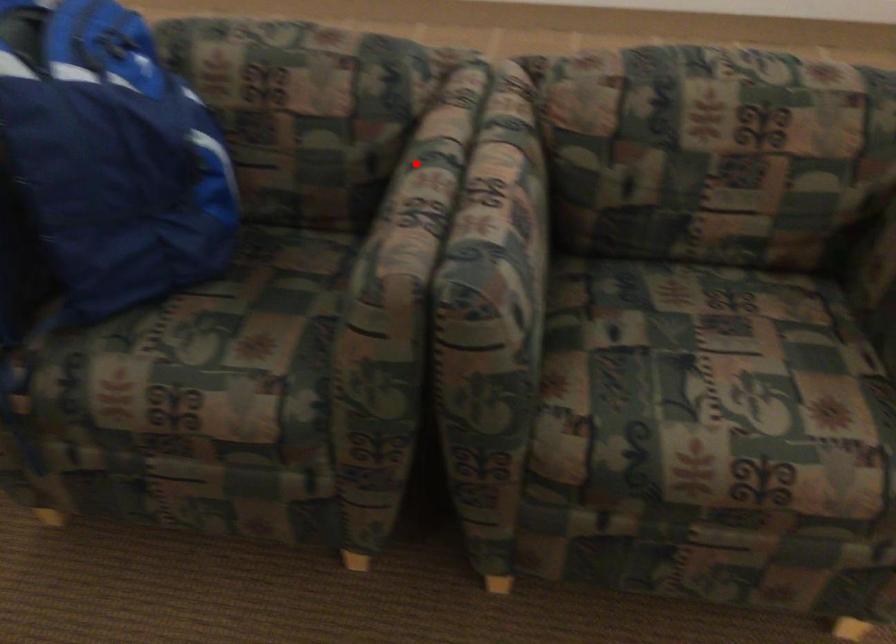
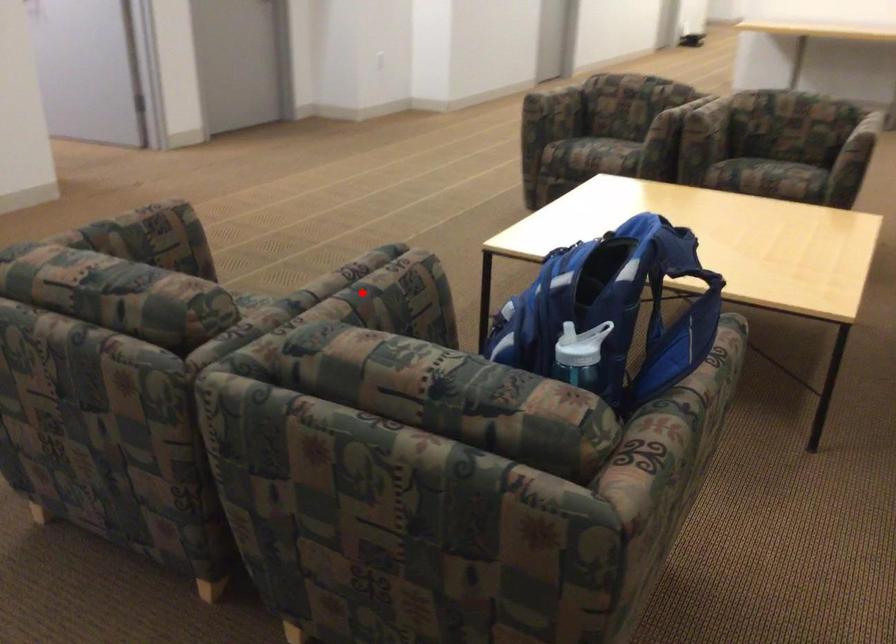
I am providing you with two images of the same scene from different viewpoints. A red point is marked on the first image and another point is marked on the second image. Is the marked point in image1 the same physical position as the marked point in image2?

Yes